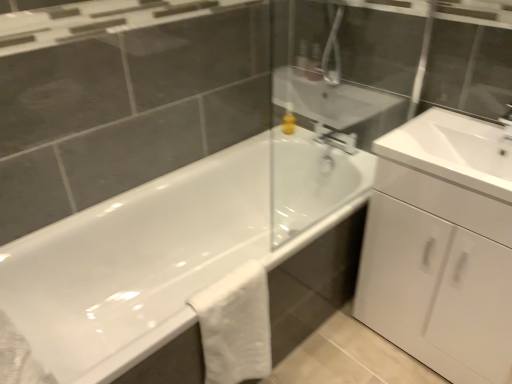
Question: Considering the relative sizes of white glossy cabinet at right and yellow matte soap dispenser at upper center in the image provided, is white glossy cabinet at right wider than yellow matte soap dispenser at upper center?

Choices:
 (A) no
 (B) yes

Answer: (B)

Question: From a real-world perspective, does white glossy cabinet at right sit lower than yellow matte soap dispenser at upper center?

Choices:
 (A) no
 (B) yes

Answer: (B)

Question: Can you confirm if white glossy cabinet at right is smaller than yellow matte soap dispenser at upper center?

Choices:
 (A) no
 (B) yes

Answer: (A)

Question: Is white glossy cabinet at right bigger than yellow matte soap dispenser at upper center?

Choices:
 (A) yes
 (B) no

Answer: (A)

Question: Is the depth of white glossy cabinet at right less than that of yellow matte soap dispenser at upper center?

Choices:
 (A) yes
 (B) no

Answer: (A)

Question: Is yellow matte soap dispenser at upper center situated inside white glossy cabinet at right or outside?

Choices:
 (A) inside
 (B) outside

Answer: (B)

Question: In terms of size, does yellow matte soap dispenser at upper center appear bigger or smaller than white glossy cabinet at right?

Choices:
 (A) big
 (B) small

Answer: (B)

Question: From a real-world perspective, is yellow matte soap dispenser at upper center positioned above or below white glossy cabinet at right?

Choices:
 (A) below
 (B) above

Answer: (B)

Question: Considering the positions of yellow matte soap dispenser at upper center and white glossy cabinet at right in the image, is yellow matte soap dispenser at upper center taller or shorter than white glossy cabinet at right?

Choices:
 (A) tall
 (B) short

Answer: (B)

Question: Is white glossy sink at right situated inside white cotton towel at lower center or outside?

Choices:
 (A) inside
 (B) outside

Answer: (B)

Question: In terms of width, does white glossy sink at right look wider or thinner when compared to white cotton towel at lower center?

Choices:
 (A) wide
 (B) thin

Answer: (A)

Question: Considering the positions of white glossy sink at right and white cotton towel at lower center in the image, is white glossy sink at right bigger or smaller than white cotton towel at lower center?

Choices:
 (A) big
 (B) small

Answer: (A)

Question: Is white glossy sink at right to the left or to the right of white cotton towel at lower center in the image?

Choices:
 (A) left
 (B) right

Answer: (B)

Question: Is yellow matte soap dispenser at upper center wider or thinner than white glossy bathtub at center?

Choices:
 (A) wide
 (B) thin

Answer: (B)

Question: From the image's perspective, is yellow matte soap dispenser at upper center located above or below white glossy bathtub at center?

Choices:
 (A) above
 (B) below

Answer: (A)